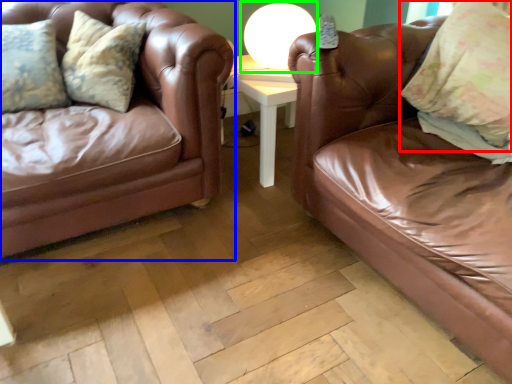
Question: Estimate the real-world distances between objects in this image. Which object is farther from pillow (highlighted by a red box), studio couch (highlighted by a blue box) or table lamp (highlighted by a green box)?

Choices:
 (A) studio couch
 (B) table lamp

Answer: (A)